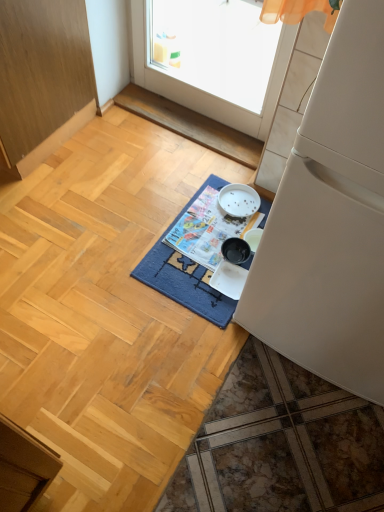
What are the coordinates of `vacant region in front of white matte refrigerator at right` in the screenshot? It's located at (280, 436).